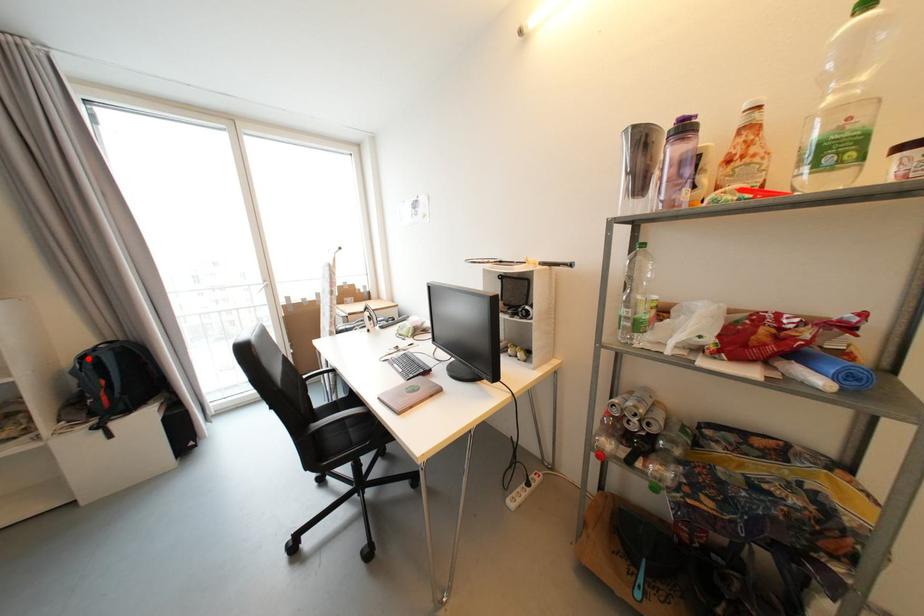
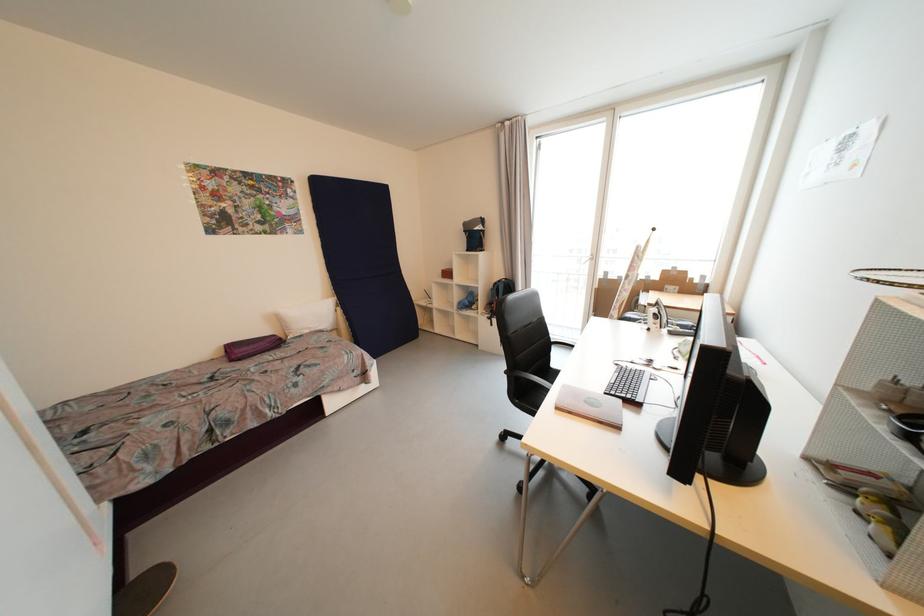
Question: I am providing you with two images of the same scene from different viewpoints. A red point is marked on the first image. At the location where the point appears in image 1, is it still visible in image 2?

Choices:
 (A) Yes
 (B) No

Answer: (A)